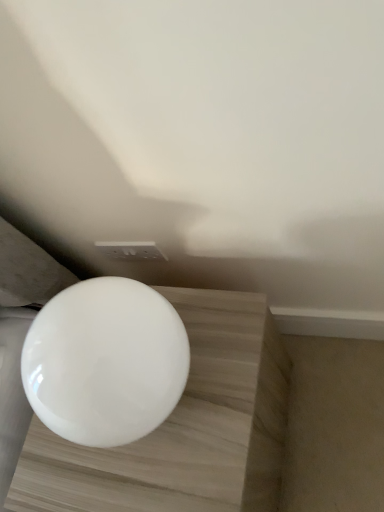
I want to click on blank space situated above white glossy toilet at center (from a real-world perspective), so click(75, 341).